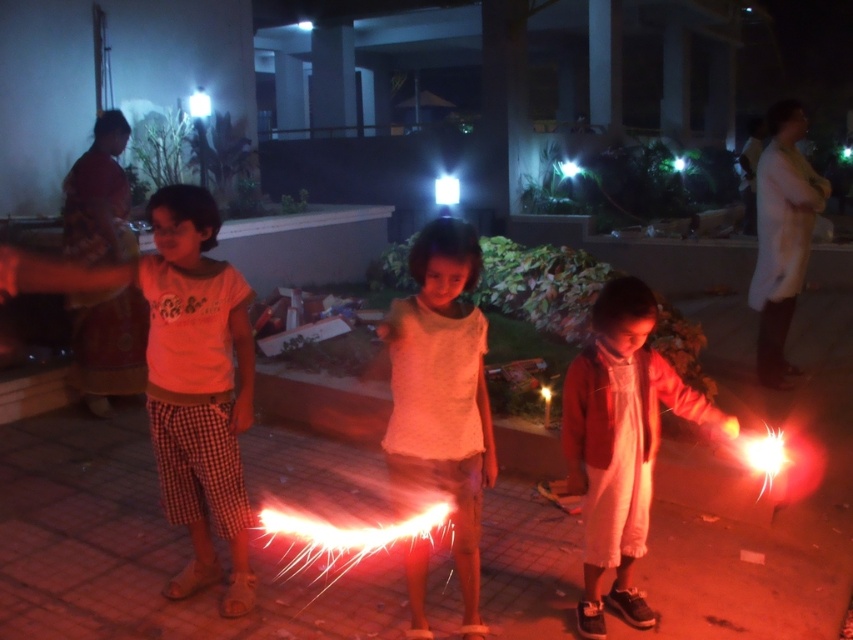
Is point (463, 589) closer to camera compared to point (630, 301)?

No, it is not.

Find the location of a particular element. This screenshot has height=640, width=853. white cotton shirt at center is located at coordinates (444, 390).

Which is behind, point (233, 515) or point (473, 625)?

The point (233, 515) is behind.

Does matte orange shirt at left come in front of white cotton shirt at center?

No, it is behind white cotton shirt at center.

Does point (195, 432) come farther from viewer compared to point (482, 477)?

Yes, point (195, 432) is behind point (482, 477).

Identify the location of matte orange shirt at left. The height and width of the screenshot is (640, 853). (183, 374).

Who is positioned more to the left, matte orange shirt at left or matte white dress at center?

Positioned to the left is matte orange shirt at left.

Is the position of matte orange shirt at left less distant than that of matte white dress at center?

That is True.

Find the location of a particular element. Image resolution: width=853 pixels, height=640 pixels. matte orange shirt at left is located at coordinates (183, 374).